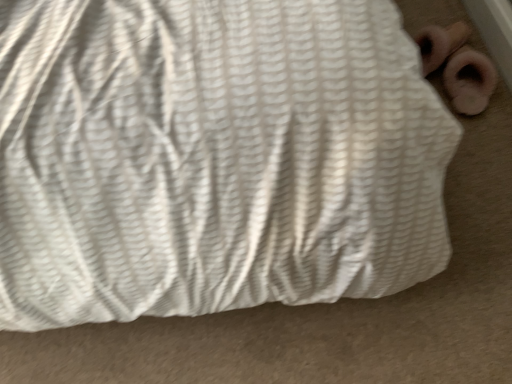
What do you see at coordinates (458, 66) in the screenshot? This screenshot has width=512, height=384. I see `pink fluffy slippers at lower right` at bounding box center [458, 66].

At what (x,y) coordinates should I click in order to perform the action: click on pink fluffy slippers at lower right. Please return your answer as a coordinate pair (x, y). Looking at the image, I should click on (458, 66).

At what (x,y) coordinates should I click in order to perform the action: click on pink fluffy slippers at lower right. Please return your answer as a coordinate pair (x, y). Looking at the image, I should click on (458, 66).